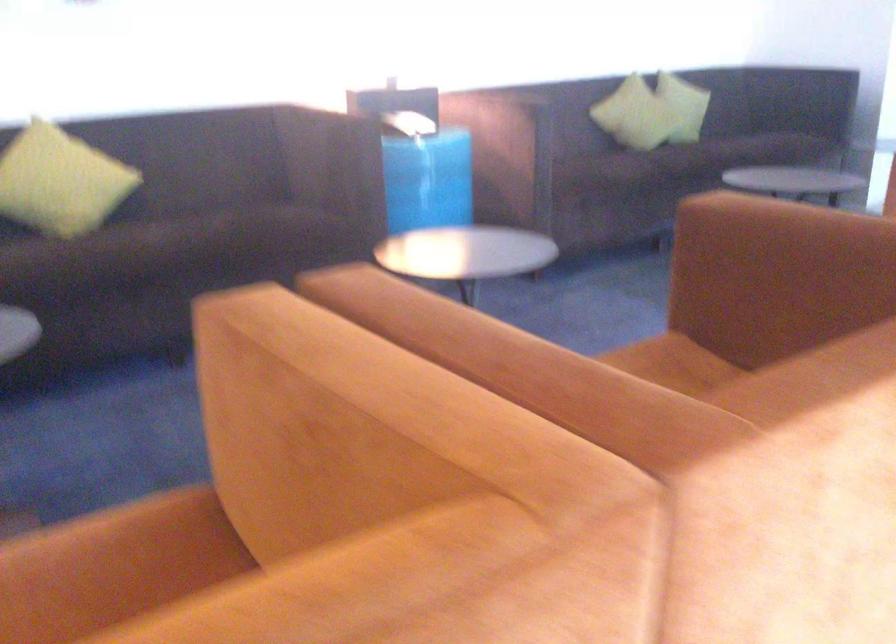
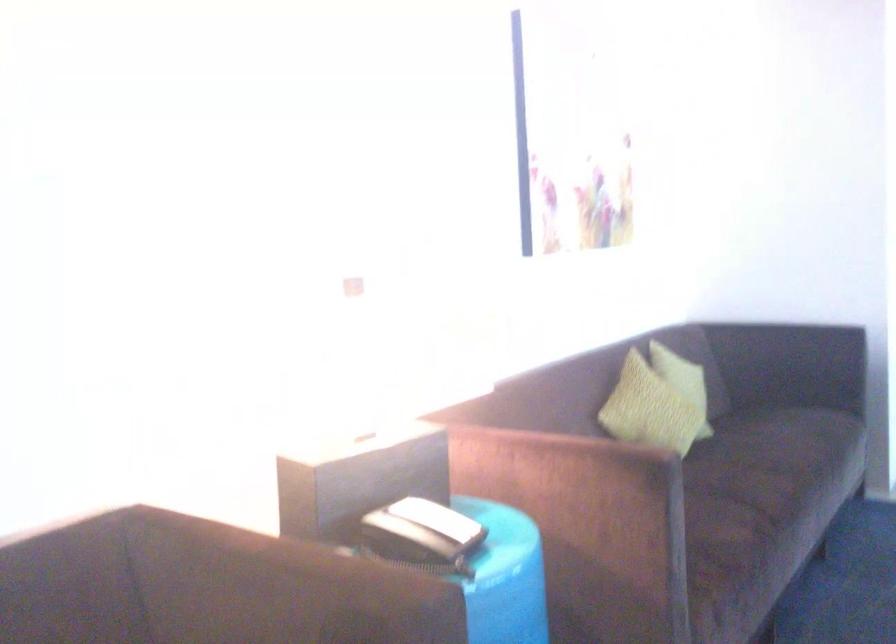
The point at (x=685, y=156) is marked in the first image. Where is the corresponding point in the second image?

(768, 489)